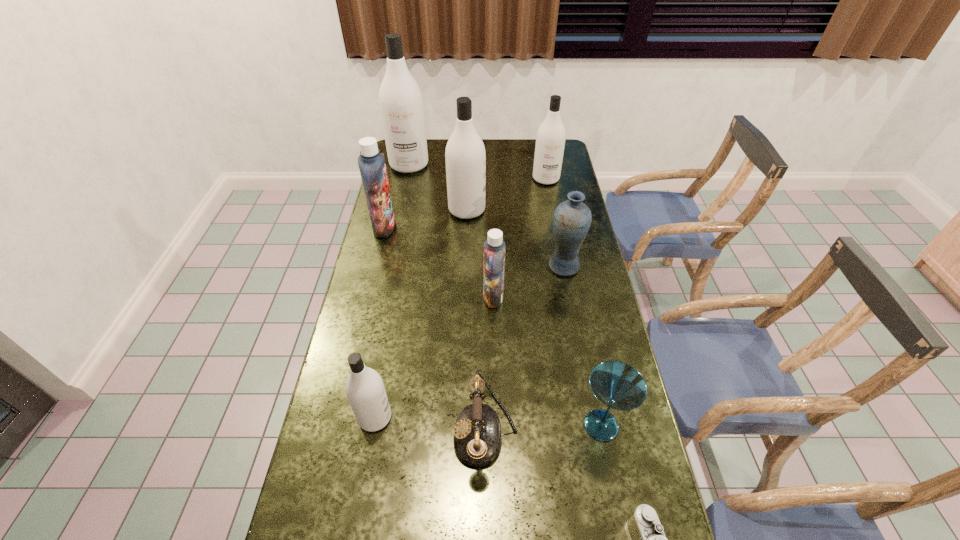
This screenshot has height=540, width=960. What are the coordinates of `vacant point located on the front-facing side of the rightmost white shampoo` in the screenshot? It's located at (558, 243).

This screenshot has height=540, width=960. I want to click on vacant space positioned 0.250m on the front of the sixth nearest object, so click(x=577, y=339).

Where is `blank space located 0.370m on the front label of the nearer blue shampoo`? blank space located 0.370m on the front label of the nearer blue shampoo is located at coordinates (370, 297).

You are a GUI agent. You are given a task and a screenshot of the screen. Output one action in this format:
    pyautogui.click(x=<x>, y=<y>)
    Task: Click on the blank space located on the front label of the nearer blue shampoo
    The image size is (960, 540).
    Given the screenshot: What is the action you would take?
    pyautogui.click(x=394, y=297)

You are a GUI agent. You are given a task and a screenshot of the screen. Output one action in this format:
    pyautogui.click(x=<x>, y=<y>)
    Task: Click on the vacant region located 0.140m on the front label of the nearer blue shampoo
    The image size is (960, 540).
    Given the screenshot: What is the action you would take?
    click(440, 297)

Locate an element on the screen. free space located 0.400m on the front-facing side of the nearest shampoo is located at coordinates (546, 417).

This screenshot has height=540, width=960. I want to click on vacant region located 0.380m on the left of the third shortest object, so click(x=428, y=426).

In order to click on vacant space situated on the dial of the black telephone in this screenshot , I will do `click(356, 430)`.

Where is `vacant space located on the dial of the black telephone`? vacant space located on the dial of the black telephone is located at coordinates (x=435, y=430).

The image size is (960, 540). What are the coordinates of `vacant space located 0.250m on the dial of the black telephone` in the screenshot? It's located at pos(356,430).